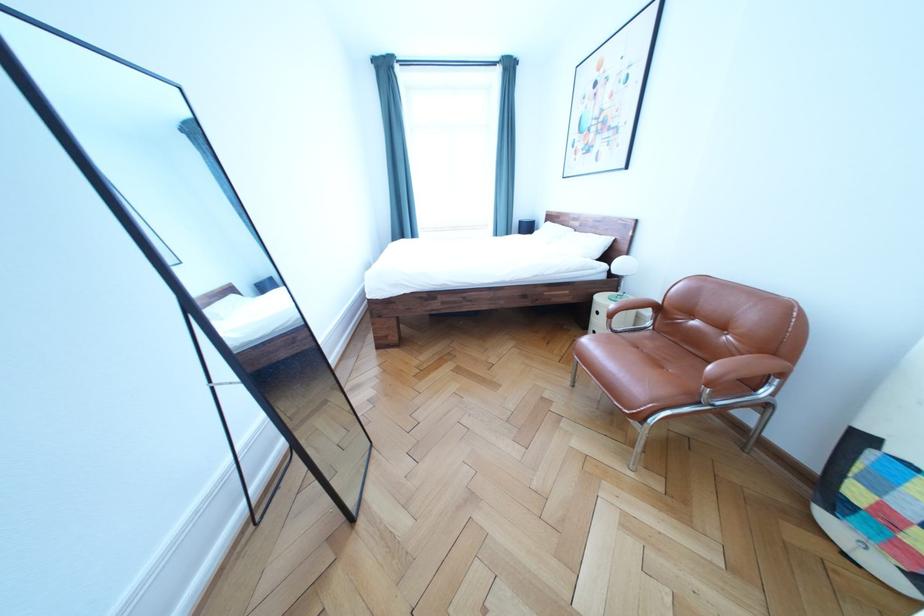
This screenshot has height=616, width=924. Find the location of `chair armrest`. chair armrest is located at coordinates (744, 369).